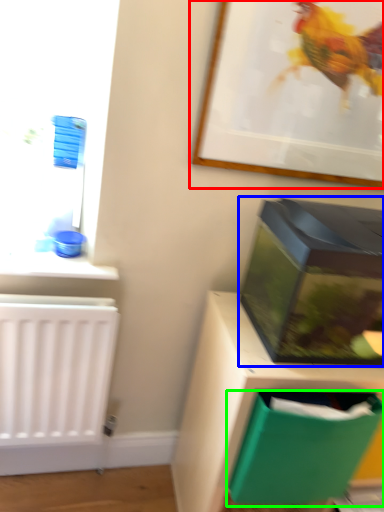
Question: Considering the real-world distances, which object is closest to picture frame (highlighted by a red box)? box (highlighted by a blue box) or storage box (highlighted by a green box).

Choices:
 (A) box
 (B) storage box

Answer: (A)